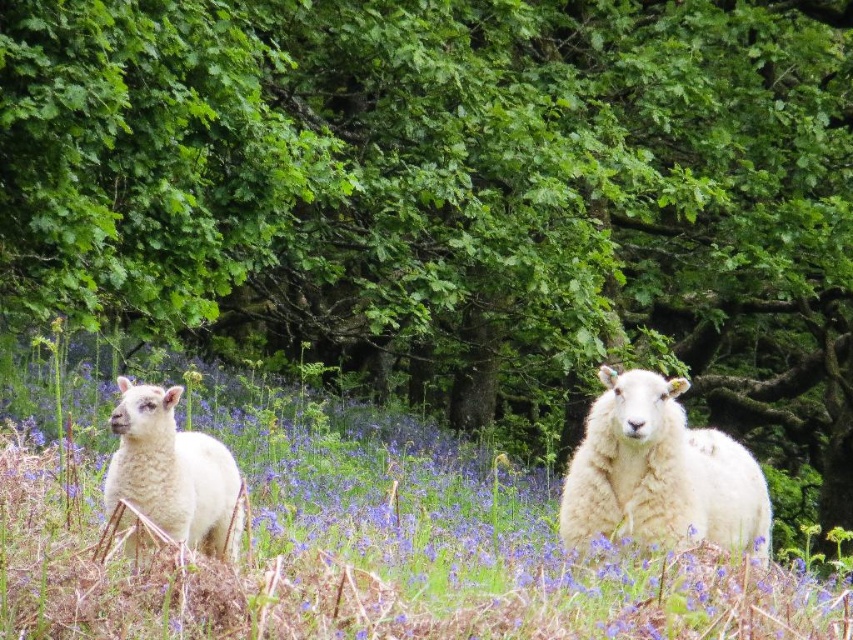
You are standing in the pastoral scene and want to place a small flag at the point closer to the camera between point [548,486] and point [142,490]. Which point should you choose?

You should choose point [548,486] because it is closer to the camera than point [142,490].